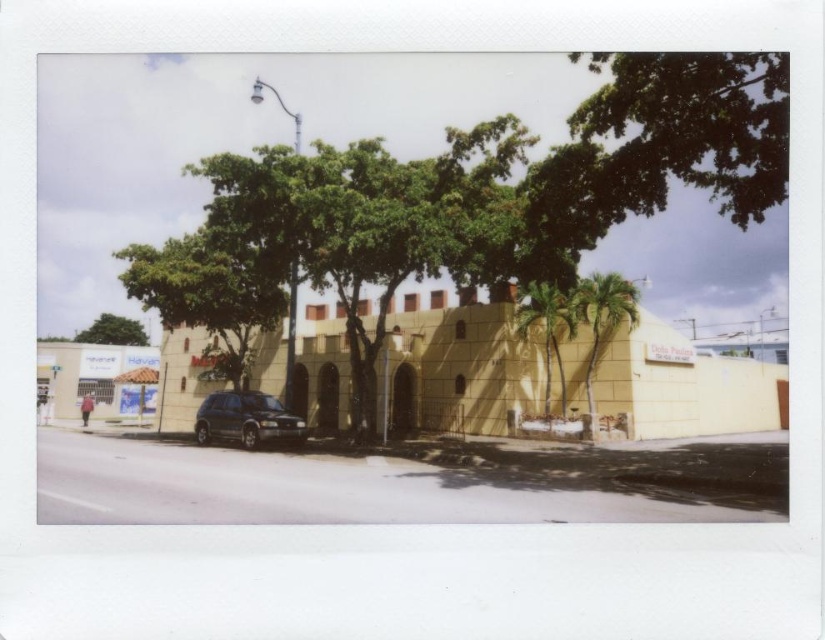
Question: Which of the following is the closest to the observer?

Choices:
 (A) (604, 333)
 (B) (529, 307)
 (C) (234, 420)

Answer: (C)

Question: Is green leafy tree at center positioned before green leafy tree at upper left?

Choices:
 (A) yes
 (B) no

Answer: (A)

Question: Which point is farther to the camera?

Choices:
 (A) (547, 310)
 (B) (767, 124)

Answer: (A)

Question: Can you confirm if green leafy palm tree at center-right is wider than green leafy tree at upper left?

Choices:
 (A) yes
 (B) no

Answer: (B)

Question: Does green leafy tree at upper right appear over green leafy tree at upper left?

Choices:
 (A) no
 (B) yes

Answer: (B)

Question: Which point is closer to the camera taking this photo?

Choices:
 (A) (550, 308)
 (B) (220, 176)
 (C) (602, 328)
 (D) (246, 429)

Answer: (B)